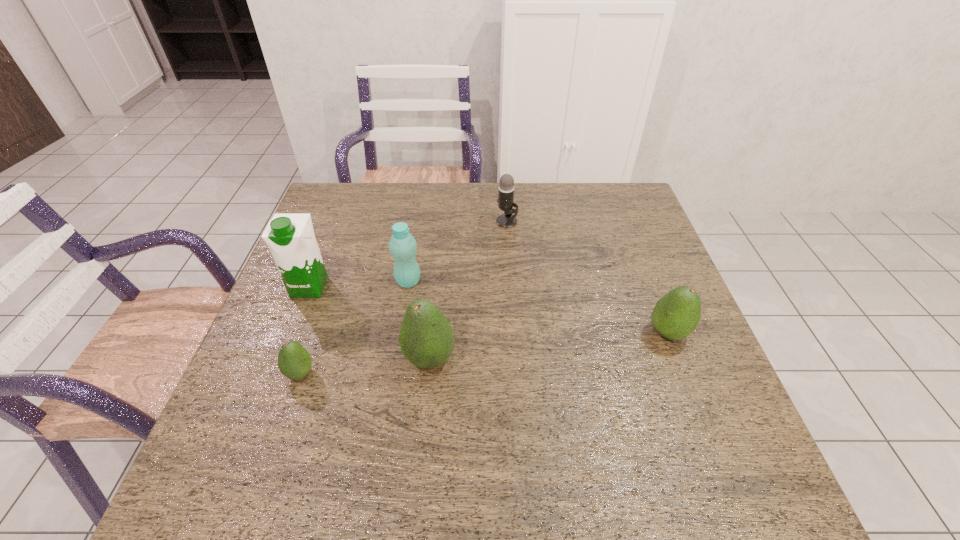
You are a GUI agent. You are given a task and a screenshot of the screen. Output one action in this format:
    pyautogui.click(x=<x>, y=<y>)
    Task: Click on the shortest avocado
    The image size is (960, 540).
    Given the screenshot: What is the action you would take?
    pyautogui.click(x=294, y=361)

At what (x,y) coordinates should I click in order to perform the action: click on the shortest object. Please return your answer as a coordinate pair (x, y). The height and width of the screenshot is (540, 960). Looking at the image, I should click on (294, 361).

The width and height of the screenshot is (960, 540). Identify the location of the second avocado from left to right. pos(426,338).

Where is `the second shortest avocado`? the second shortest avocado is located at coordinates (676, 315).

Image resolution: width=960 pixels, height=540 pixels. Identify the location of the rightmost avocado. (676, 315).

This screenshot has height=540, width=960. Identify the location of the fifth object from left to right. (505, 199).

Find the location of a particular element. The height and width of the screenshot is (540, 960). microphone is located at coordinates (505, 199).

Identify the location of bottle. This screenshot has height=540, width=960. (402, 245).

I want to click on the tallest object, so click(290, 237).

This screenshot has width=960, height=540. I want to click on free space located 0.200m on the back of the shortest object, so click(x=326, y=296).